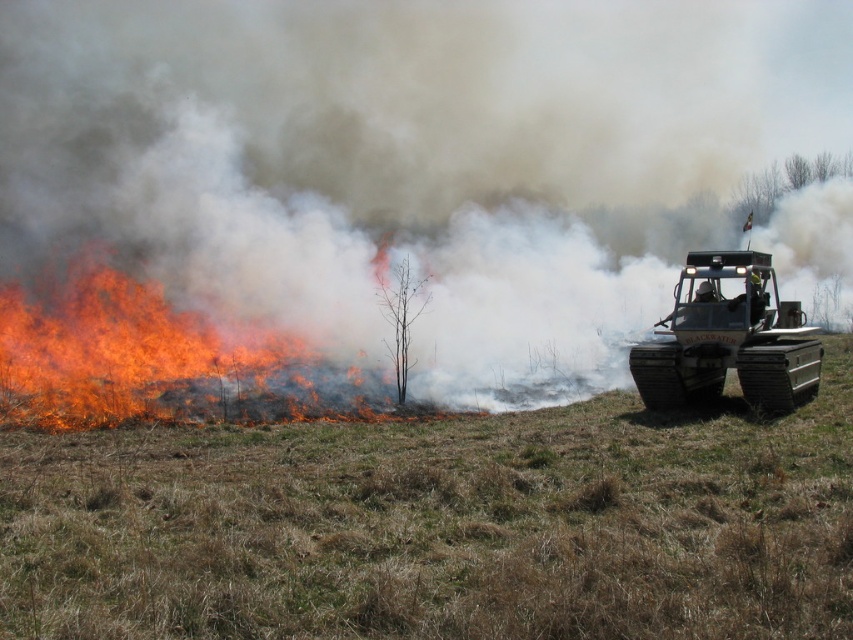
You are a firefighter trying to assess the spread of the fire. Given that the white smoke at center is at coordinates 0.244, 0.482, where would you expect the fire source to be relative to this smoke?

The fire source is likely to the left of the white smoke at center, as the fire is actively burning on the left side of the frame and the smoke is rising from that area.